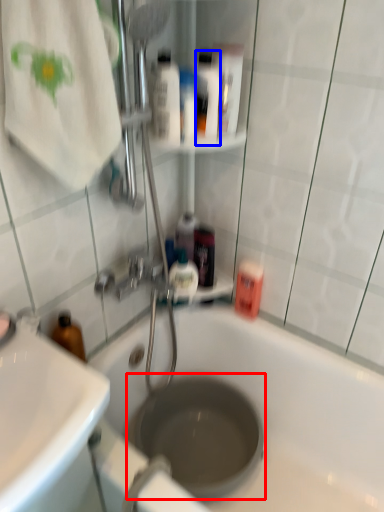
Question: Among these objects, which one is nearest to the camera, hole (highlighted by a red box) or mouthwash (highlighted by a blue box)?

Choices:
 (A) hole
 (B) mouthwash

Answer: (B)